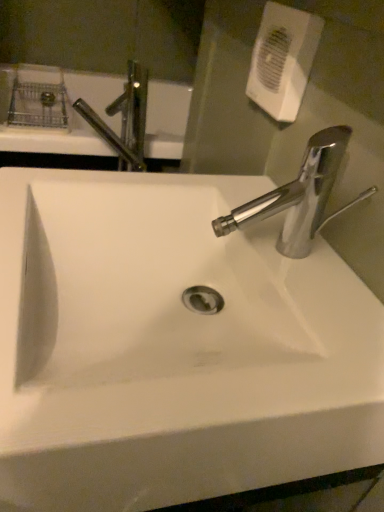
The image size is (384, 512). I want to click on white plastic hand dryer at upper right, so click(282, 60).

What do you see at coordinates (282, 60) in the screenshot?
I see `white plastic hand dryer at upper right` at bounding box center [282, 60].

Image resolution: width=384 pixels, height=512 pixels. In order to click on white plastic hand dryer at upper right in this screenshot , I will do `click(282, 60)`.